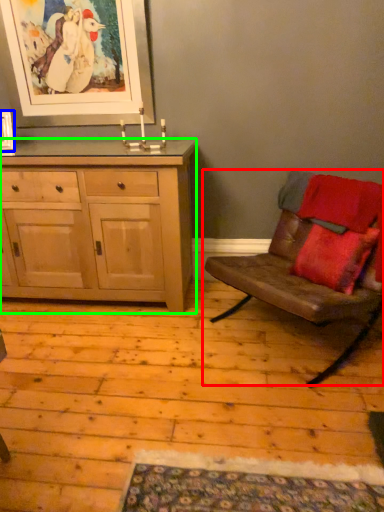
Question: Which object is the closest to the chair (highlighted by a red box)? Choose among these: picture frame (highlighted by a blue box) or cabinetry (highlighted by a green box).

Choices:
 (A) picture frame
 (B) cabinetry

Answer: (B)